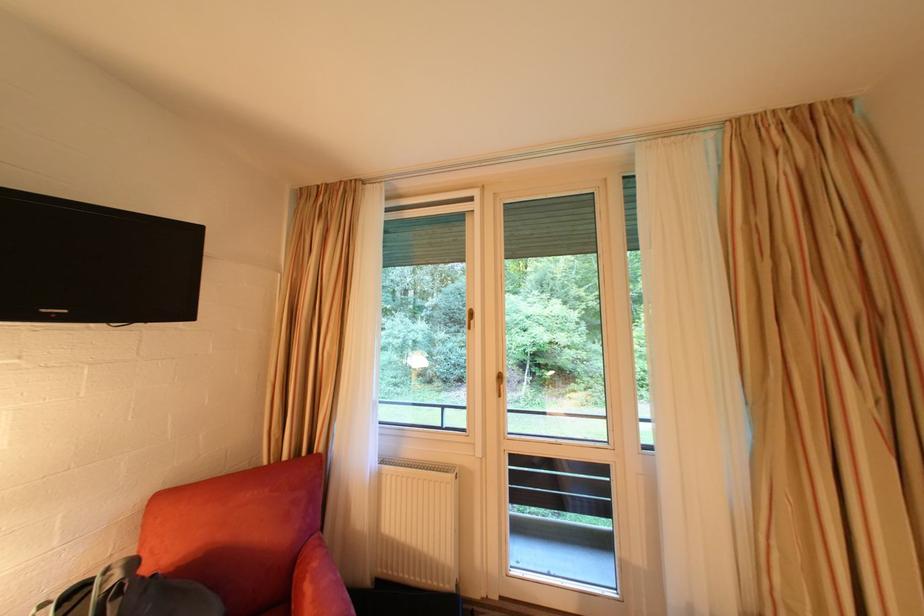
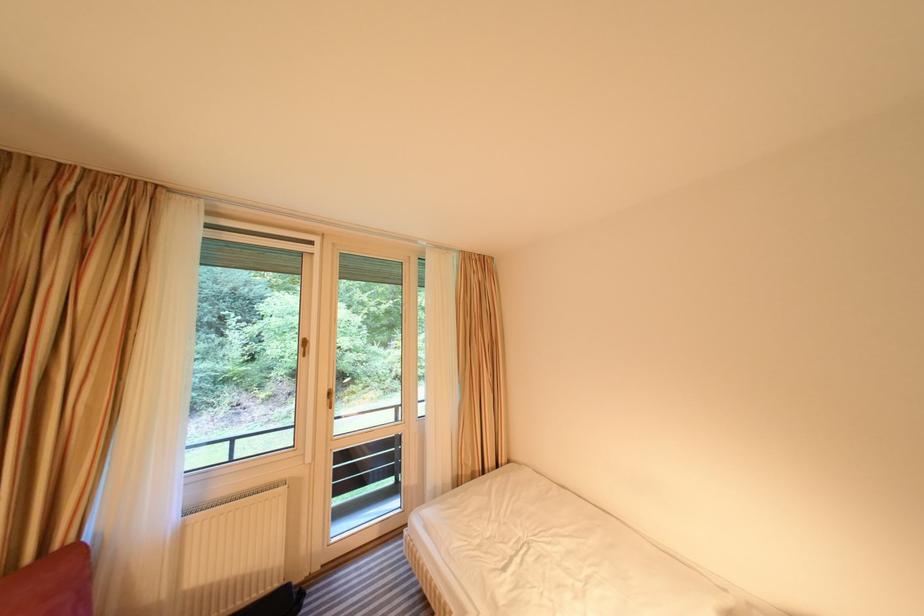
Find the pixel in the second image that matches pixel 312 474 in the first image.

(57, 578)